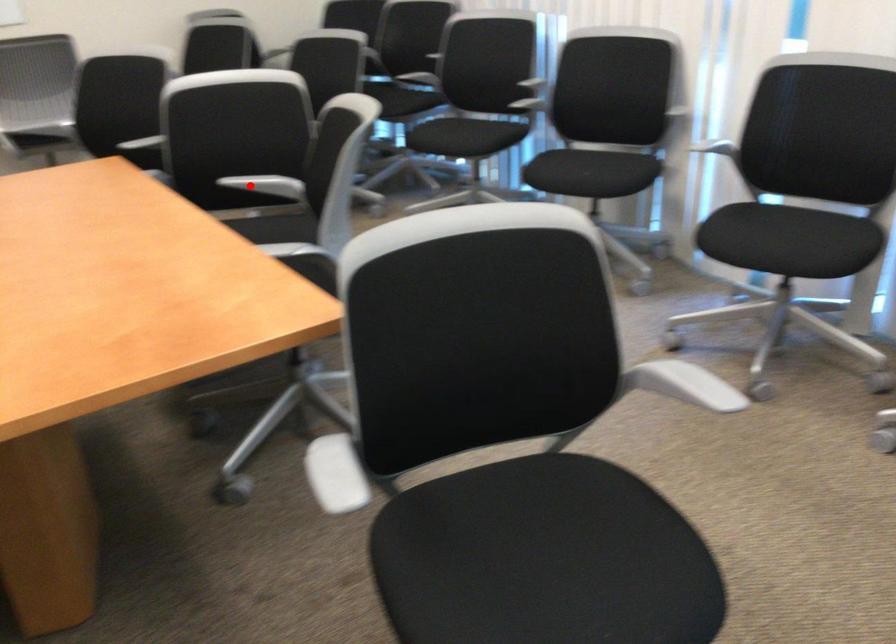
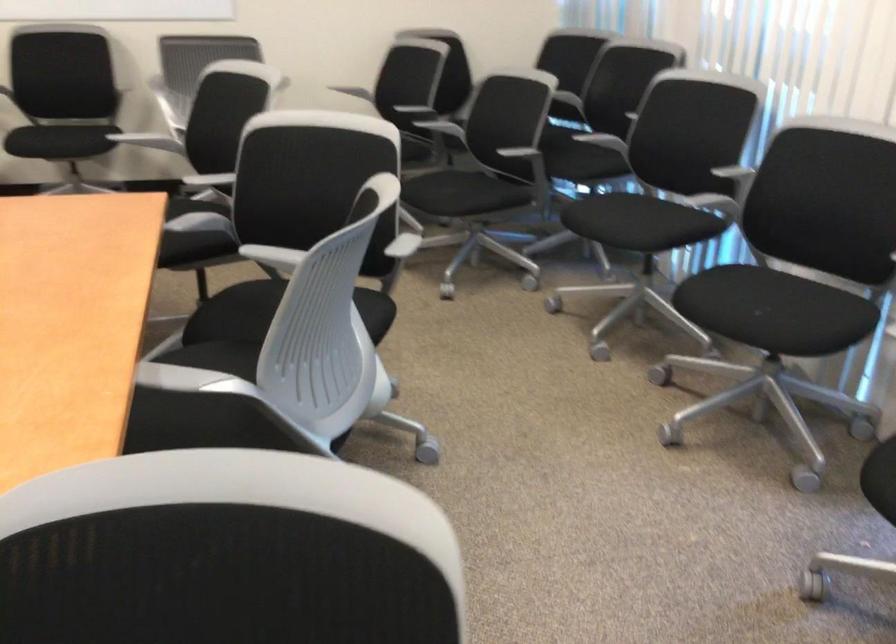
Question: I am providing you with two images of the same scene from different viewpoints. Given a red point in image1, look at the same physical point in image2. Is it:

Choices:
 (A) Closer to the viewpoint
 (B) Farther from the viewpoint

Answer: (A)